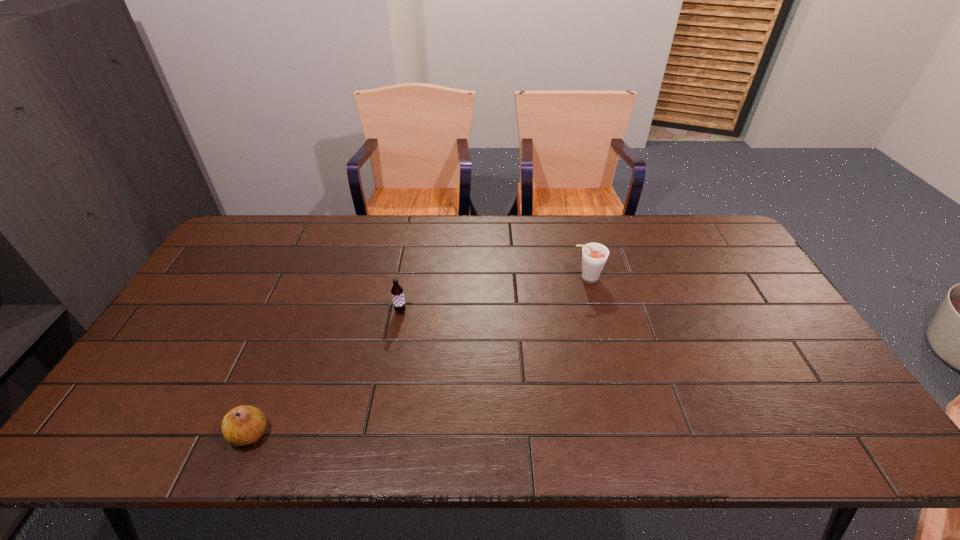
The image size is (960, 540). I want to click on vacant space situated on the right of the pear, so click(432, 434).

The width and height of the screenshot is (960, 540). Identify the location of object that is at the near edge. (243, 425).

At what (x,y) coordinates should I click in order to perform the action: click on vacant region at the far edge of the desktop. Please return your answer as a coordinate pair (x, y). Image resolution: width=960 pixels, height=540 pixels. Looking at the image, I should click on (468, 220).

Find the location of a particular element. free spot at the near edge of the desktop is located at coordinates (713, 437).

In the image, there is a desktop. At what (x,y) coordinates should I click in order to perform the action: click on blank space at the left edge. Please return your answer as a coordinate pair (x, y). Looking at the image, I should click on (203, 331).

The image size is (960, 540). I want to click on free space at the right edge of the desktop, so click(x=751, y=342).

At what (x,y) coordinates should I click in order to perform the action: click on empty space between the nearer root beer and the nearest object. Please return your answer as a coordinate pair (x, y). The height and width of the screenshot is (540, 960). Looking at the image, I should click on (325, 373).

Where is `free space between the leftmost object and the rightmost object`? The width and height of the screenshot is (960, 540). free space between the leftmost object and the rightmost object is located at coordinates (418, 356).

Where is `unoccupied position between the nearest object and the rightmost object`? The image size is (960, 540). unoccupied position between the nearest object and the rightmost object is located at coordinates (418, 356).

Locate an element on the screen. unoccupied area between the pear and the second object from right to left is located at coordinates (325, 373).